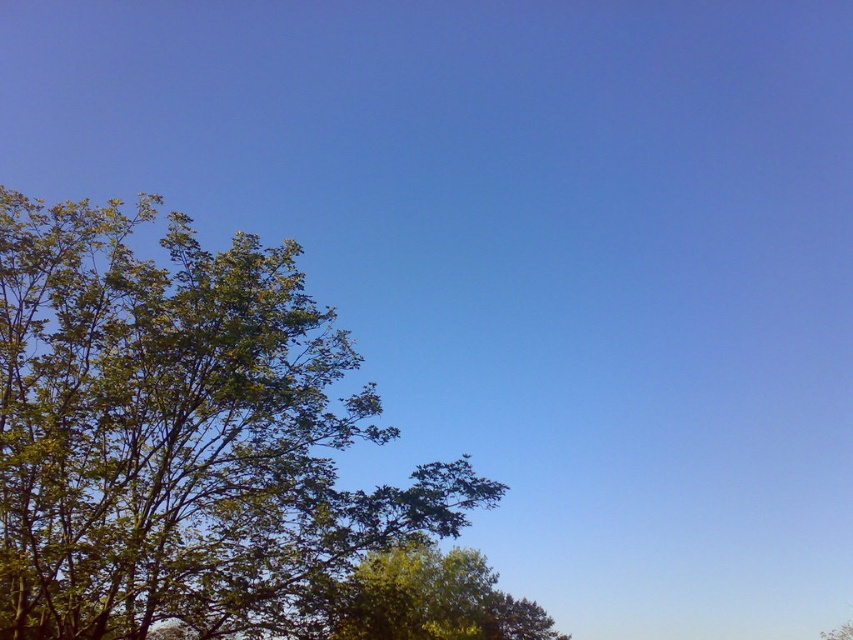
Question: Observing the image, what is the correct spatial positioning of green leafy tree at left in reference to green leafy tree at lower center?

Choices:
 (A) above
 (B) below

Answer: (A)

Question: From the image, what is the correct spatial relationship of green leafy tree at left in relation to green leafy tree at lower center?

Choices:
 (A) left
 (B) right

Answer: (A)

Question: Can you confirm if green leafy tree at left is wider than green leafy tree at lower center?

Choices:
 (A) no
 (B) yes

Answer: (A)

Question: Among these objects, which one is farthest from the camera?

Choices:
 (A) green leafy tree at left
 (B) green leafy tree at lower center

Answer: (B)

Question: Which of the following is the farthest from the observer?

Choices:
 (A) pos(422,570)
 (B) pos(170,397)

Answer: (A)